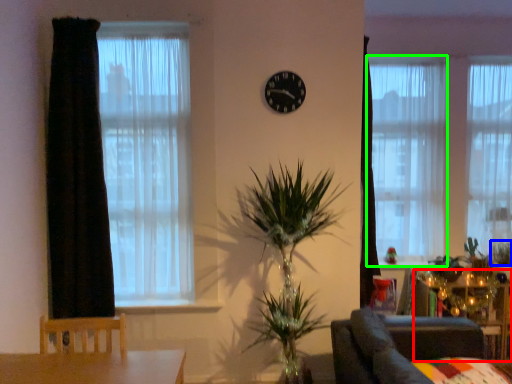
Question: Which is nearer to the side table (highlighted by a red box)? plant (highlighted by a blue box) or curtain (highlighted by a green box).

Choices:
 (A) plant
 (B) curtain

Answer: (A)